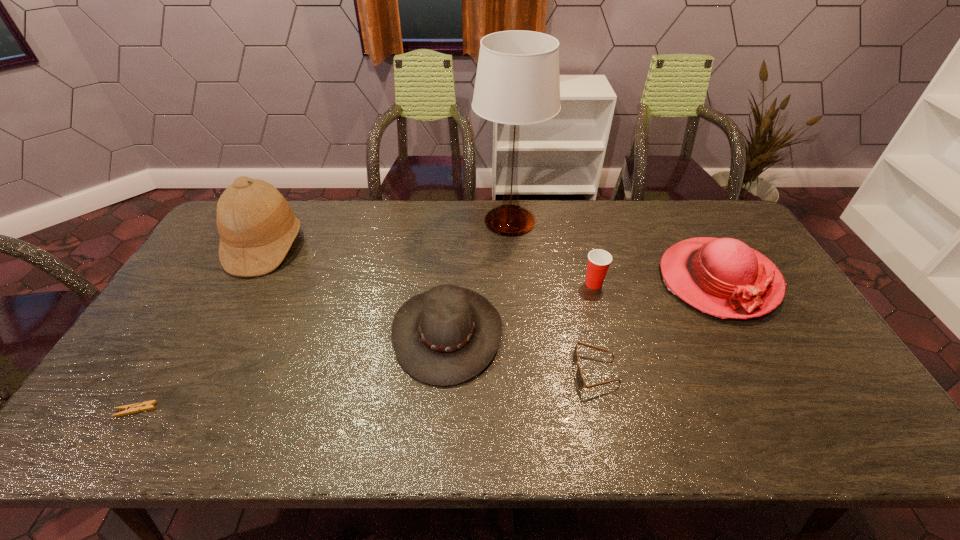
Locate an element on the screen. free space between the table lamp and the Dixie cup is located at coordinates (552, 252).

Find the location of a particular element. free space that is in between the table lamp and the second tallest object is located at coordinates (387, 234).

Where is `object that is the sixth closest to the sunglasses`? object that is the sixth closest to the sunglasses is located at coordinates (148, 405).

Choose which object is the fourth nearest neighbor to the second hat from right to left. Please provide its 2D coordinates. Your answer should be formatted as a tuple, i.e. [(x, y)], where the tuple contains the x and y coordinates of a point satisfying the conditions above.

[(257, 227)]

Find the location of a particular element. Image resolution: width=960 pixels, height=540 pixels. hat that is the second closest to the Dixie cup is located at coordinates (445, 336).

This screenshot has height=540, width=960. I want to click on hat that can be found as the second closest to the second hat from right to left, so click(723, 277).

Locate an element on the screen. The image size is (960, 540). vacant region that satisfies the following two spatial constraints: 1. on the front-facing side of the leftmost hat; 2. on the left side of the Dixie cup is located at coordinates (245, 284).

I want to click on free space that satisfies the following two spatial constraints: 1. on the front-facing side of the Dixie cup; 2. on the right side of the sixth shortest object, so click(x=245, y=284).

The width and height of the screenshot is (960, 540). Find the location of `vacant space that satisfies the following two spatial constraints: 1. above the cylindrical shade of the table lamp; 2. on the right side of the Dixie cup`. vacant space that satisfies the following two spatial constraints: 1. above the cylindrical shade of the table lamp; 2. on the right side of the Dixie cup is located at coordinates (x=515, y=284).

I want to click on vacant space that satisfies the following two spatial constraints: 1. above the cylindrical shade of the table lamp; 2. on the front side of the shortest object, so click(525, 410).